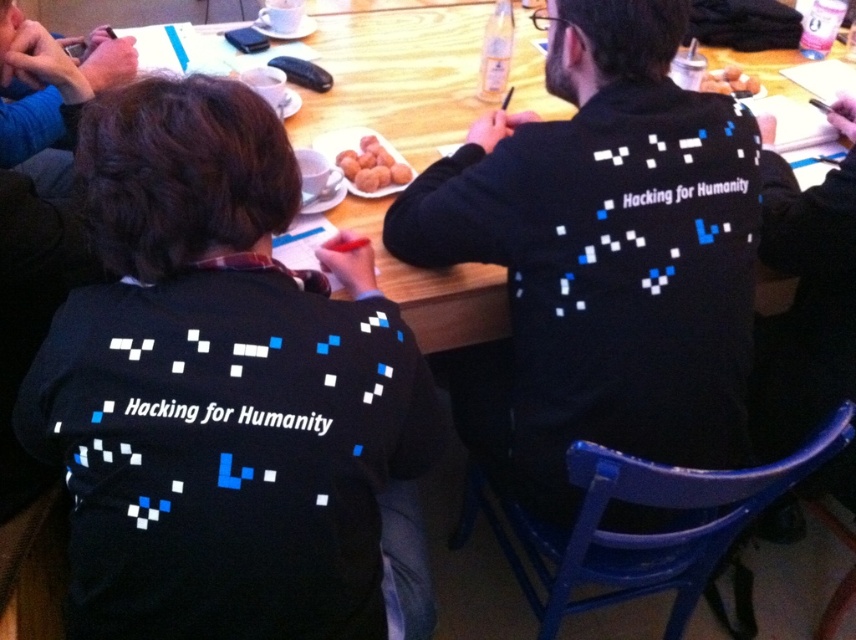
From the picture: You are a photographer who needs to capture a clear shot of the wooden table at center without the black matte shirt at center blocking it. What adjustment should you make to your camera angle?

The black matte shirt at center is in front of the wooden table at center, so to capture a clear shot of the wooden table at center without obstruction, you should adjust your camera angle to look behind the black matte shirt at center.

You are a photographer taking a picture of the group. You notice two black matte items at the center of the table. Which one is closer to the camera, the black matte shirt at center or the black matte sweater at center?

The black matte shirt at center is closer to the camera because it is in front of the black matte sweater at center.

You are organizing a workshop and need to decide which item to place in a narrow drawer. You have the black matte shirt at center and the wooden table at center. Which item can fit better in the narrow drawer?

The black matte shirt at center is thinner than the wooden table at center, so it can fit better in the narrow drawer.